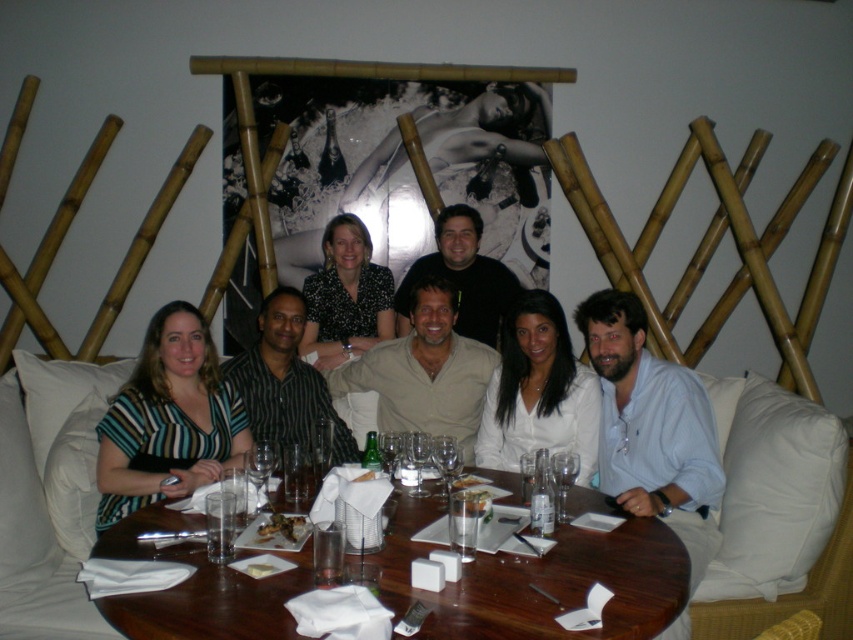
You are standing at the entrance of the dining area and want to find the striped fabric shirt at left. According to the coordinates provided, where should you look relative to the center of the image?

The striped fabric shirt at left is located at point 0.656 on the x axis and 0.198 on the y axis, so you should look to the right and slightly above the center of the image.

You are a photographer taking a group photo of the people around the table. You want to ensure that both the striped fabric shirt at center and the black dotted blouse at center are visible in the frame. Given their heights, which one might you need to ask to adjust their position to ensure visibility?

The striped fabric shirt at center is much taller than the black dotted blouse at center. To ensure visibility of both, you might ask the person wearing the black dotted blouse at center to move slightly forward or the taller individual in the striped fabric shirt at center to lean back, allowing the shorter one to be seen better.

You are taking a photo of the dining table and notice two points marked on the image. The first point is at coordinates point (691, 380) and the second is at point (360, 332). Which point is closer to the camera in the photo?

Point (691, 380) is closer to the camera than point (360, 332).